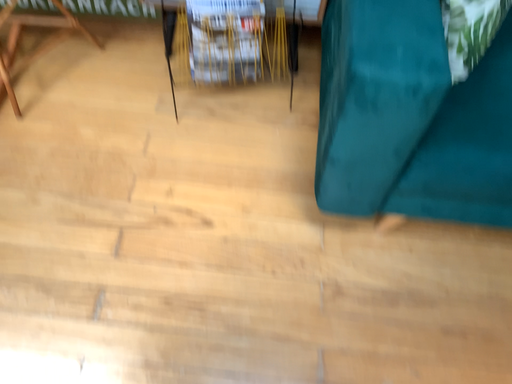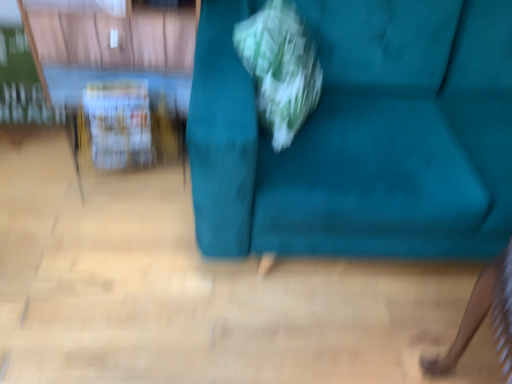
Question: Which way did the camera rotate in the video?

Choices:
 (A) rotated upward
 (B) rotated downward

Answer: (A)